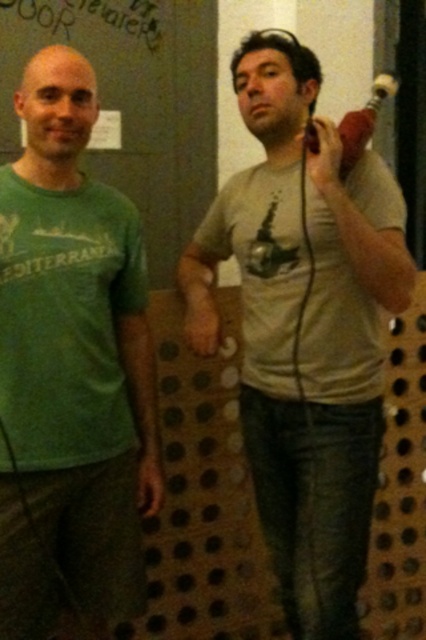
You are standing in the room and want to determine which point is closer to you. The points are point (299, 609) and point (374, 106). Which point is closer?

Point (299, 609) is closer to you because it is further to the viewer than point (374, 106).